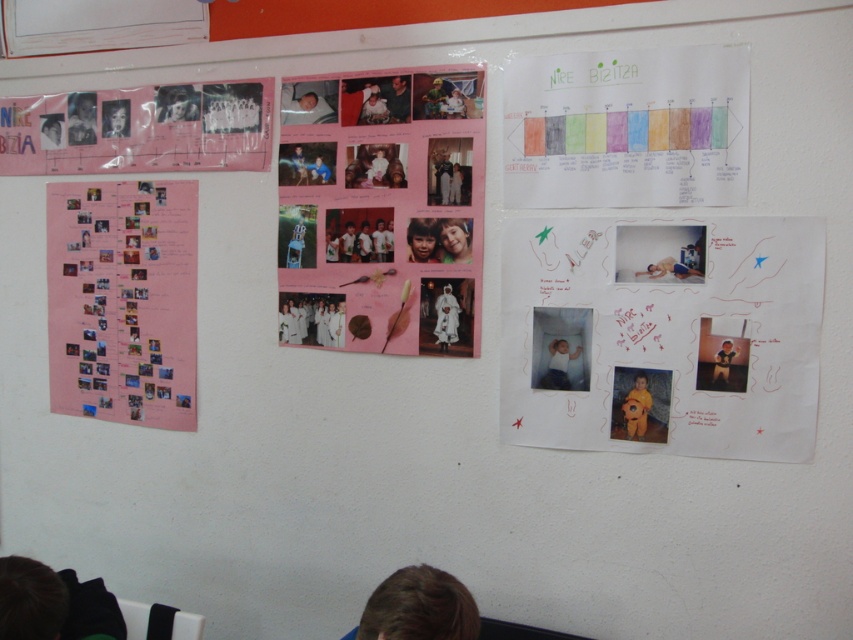
You are a student in the classroom and need to hang a new notice that requires a taller surface. Which object from the white paper at center and the watercolor paper chart at upper right would be more suitable for this purpose?

The white paper at center is taller than the watercolor paper chart at upper right, so it would be more suitable for hanging a notice that requires a taller surface.

You are a student in the classroom and want to hang a new poster between the watercolor paper chart at upper right and the matte pink poster at upper left. Based on their positions, where should you place the new poster?

The watercolor paper chart at upper right is below the matte pink poster at upper left, so to place the new poster between them, you should position it between the matte pink poster at upper left and the watercolor paper chart at upper right, ensuring it is above the watercolor paper chart at upper right and below the matte pink poster at upper left.